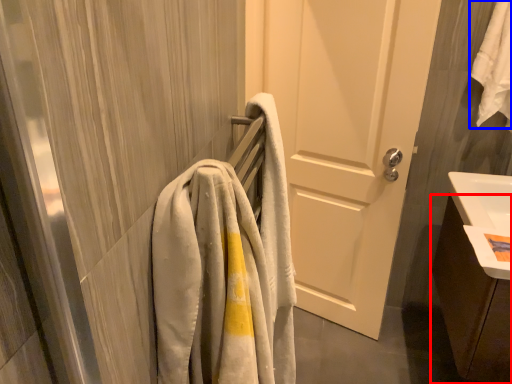
Question: Which object is closer to the camera taking this photo, bathroom cabinet (highlighted by a red box) or bath towel (highlighted by a blue box)?

Choices:
 (A) bathroom cabinet
 (B) bath towel

Answer: (A)